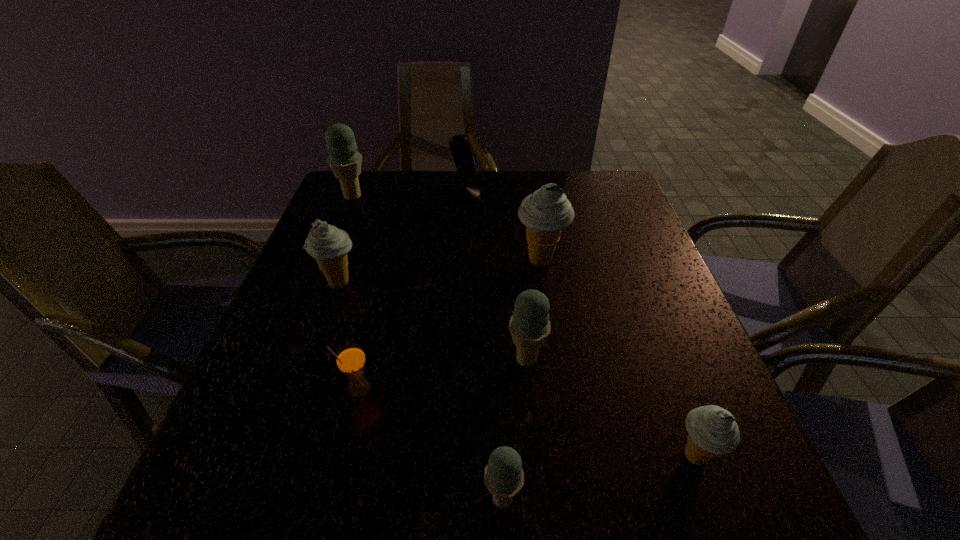
Image resolution: width=960 pixels, height=540 pixels. Identify the location of vacant area between the sixth object from right to left and the fifth farthest object. (444, 375).

Where is `empty location between the straw and the black microphone`? The width and height of the screenshot is (960, 540). empty location between the straw and the black microphone is located at coordinates (412, 292).

Locate an element on the screen. The image size is (960, 540). object identified as the fourth closest to the second biggest beige icecream is located at coordinates (529, 326).

Identify which object is located as the sixth nearest to the leftmost beige icecream. Please provide its 2D coordinates. Your answer should be formatted as a tuple, i.e. [(x, y)], where the tuple contains the x and y coordinates of a point satisfying the conditions above.

[(504, 476)]

Locate an element on the screen. ice cream that is the fourth closest to the third object from left to right is located at coordinates (545, 213).

Identify which ice cream is the fifth nearest to the third object from left to right. Please provide its 2D coordinates. Your answer should be formatted as a tuple, i.e. [(x, y)], where the tuple contains the x and y coordinates of a point satisfying the conditions above.

[(712, 430)]

The height and width of the screenshot is (540, 960). What are the coordinates of `the closest beige icecream to the nearest blue ice cream` in the screenshot? It's located at (712, 430).

Where is `the closest beige icecream to the fifth farthest ice cream`? The width and height of the screenshot is (960, 540). the closest beige icecream to the fifth farthest ice cream is located at coordinates (545, 213).

I want to click on blue ice cream that can be found as the second closest to the smallest blue ice cream, so coord(345,161).

Select which blue ice cream is the second closest to the second farthest blue ice cream. Please provide its 2D coordinates. Your answer should be formatted as a tuple, i.e. [(x, y)], where the tuple contains the x and y coordinates of a point satisfying the conditions above.

[(345, 161)]